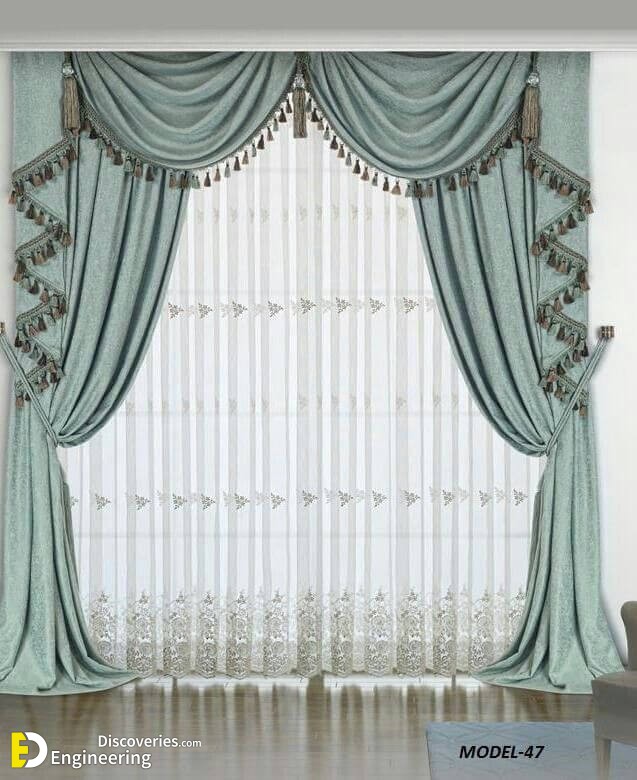
Locate an element on the screen. The height and width of the screenshot is (780, 637). wall is located at coordinates (619, 260), (9, 261).